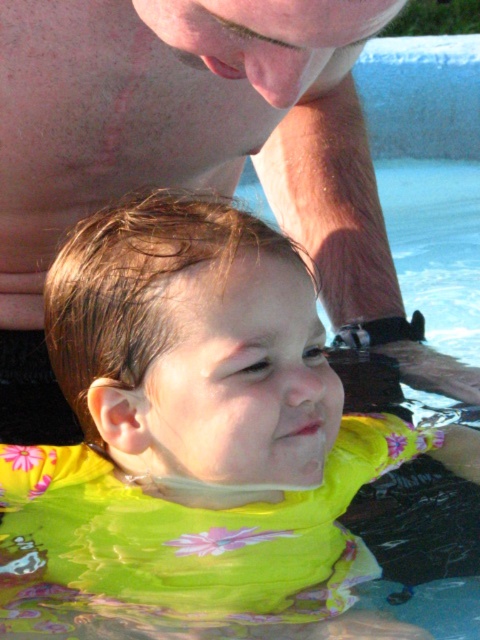
You are a lifeguard on duty and need to determine if the yellow fabric float at center can be used to support the pink skin at upper center. Based on their sizes, will the float be able to adequately support the skin?

The yellow fabric float at center is thinner than the pink skin at upper center, so it may not provide sufficient support for the skin.

You are a lifeguard on duty and notice the yellow fabric float at center and the pink skin at upper center in the pool. Which object is positioned lower in the water?

The yellow fabric float at center is located below pink skin at upper center, so the yellow fabric float at center is positioned lower in the water.